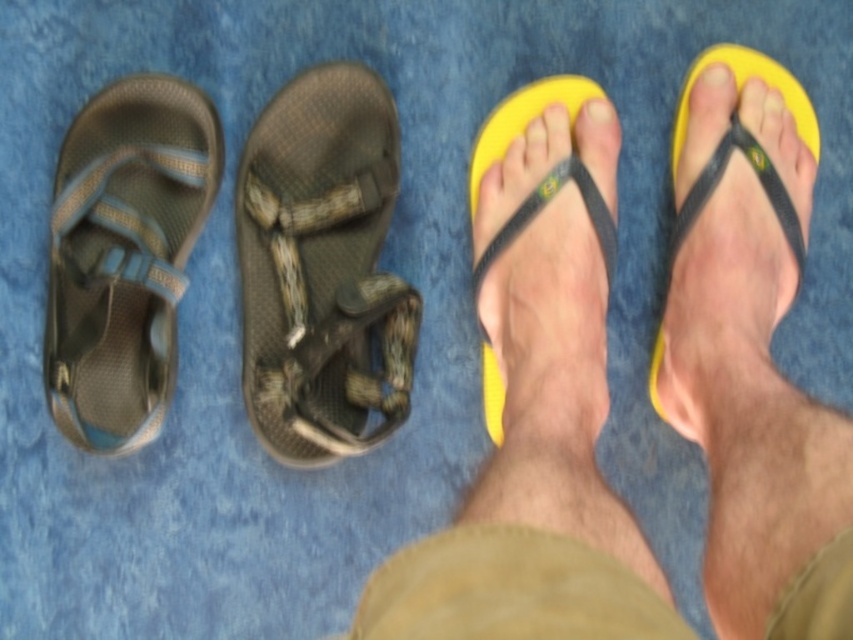
You are trying to find the textured brown sandal at center. According to the coordinates provided, where exactly is it positioned in the image?

The textured brown sandal at center is located at point coordinates of (322, 268).